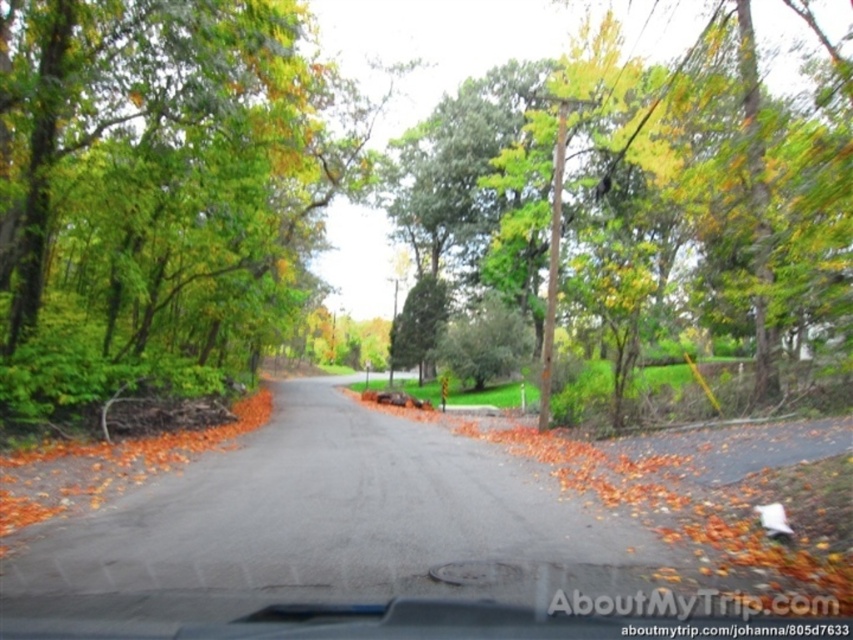
Question: Among these points, which one is nearest to the camera?

Choices:
 (A) (525, 292)
 (B) (672, 540)

Answer: (B)

Question: Can you confirm if green leafy tree at center is thinner than orange leaf litter at center?

Choices:
 (A) yes
 (B) no

Answer: (B)

Question: Can you confirm if green leafy tree at center is positioned above orange leaf litter at center?

Choices:
 (A) no
 (B) yes

Answer: (B)

Question: Is green leafy tree at center to the right of orange leaf litter at center from the viewer's perspective?

Choices:
 (A) yes
 (B) no

Answer: (A)